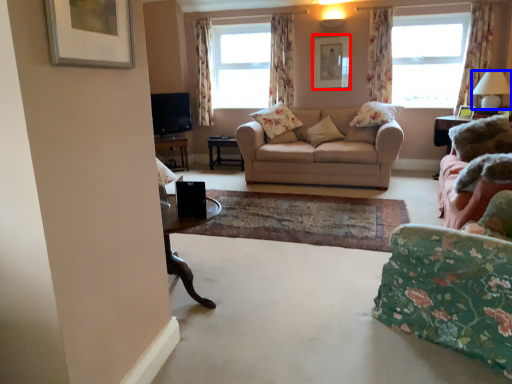
Question: Which object is further to the camera taking this photo, picture frame (highlighted by a red box) or lamp (highlighted by a blue box)?

Choices:
 (A) picture frame
 (B) lamp

Answer: (A)